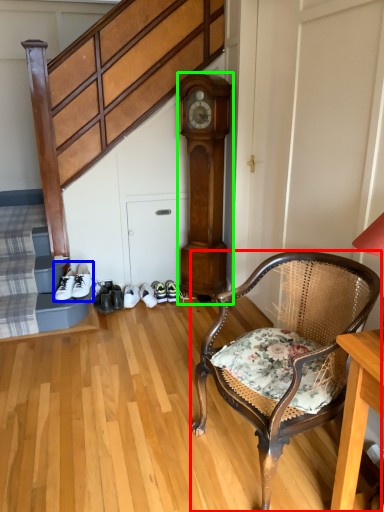
Question: Considering the real-world distances, which object is closest to chair (highlighted by a red box)? footwear (highlighted by a blue box) or clock (highlighted by a green box).

Choices:
 (A) footwear
 (B) clock

Answer: (B)